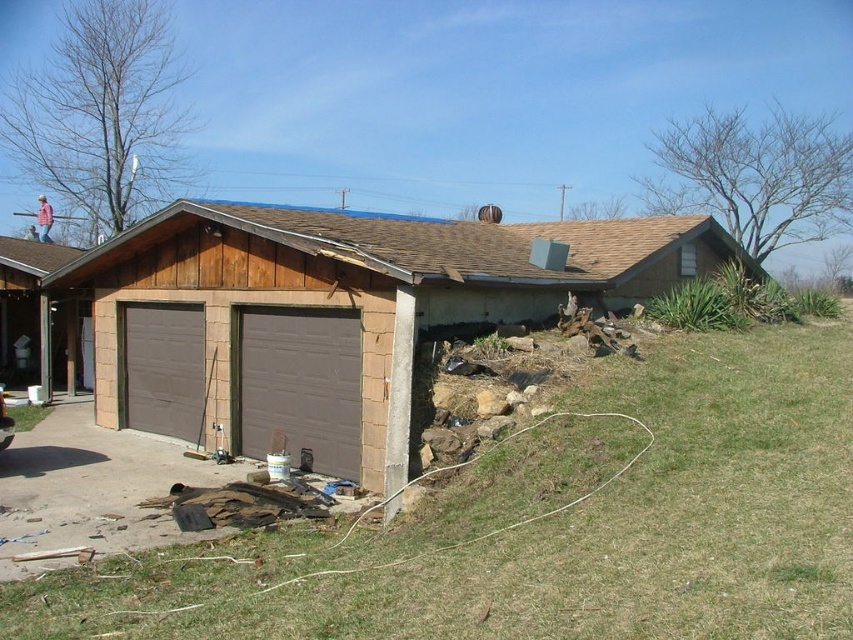
Question: Can you confirm if brown matte garage door at center is bigger than brown matte garage door at left?

Choices:
 (A) yes
 (B) no

Answer: (B)

Question: Does brown wood shed at center have a smaller size compared to brown matte garage door at center?

Choices:
 (A) no
 (B) yes

Answer: (A)

Question: Can you confirm if brown matte garage door at center is positioned below brown matte garage door at left?

Choices:
 (A) no
 (B) yes

Answer: (B)

Question: Which object is farther from the camera taking this photo?

Choices:
 (A) brown concrete driveway at lower left
 (B) brown wood shed at center
 (C) brown matte garage door at left
 (D) brown matte garage door at center

Answer: (C)

Question: Which point is closer to the camera taking this photo?

Choices:
 (A) (149, 365)
 (B) (247, 444)

Answer: (B)

Question: Which point is farther to the camera?

Choices:
 (A) brown matte garage door at left
 (B) brown wood shed at center
 (C) brown concrete driveway at lower left

Answer: (A)